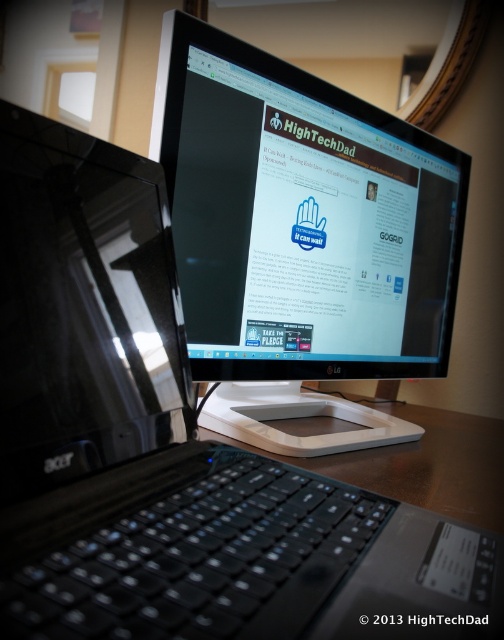
Does black glossy monitor at upper center appear on the right side of brown wooden table at center?

In fact, black glossy monitor at upper center is to the left of brown wooden table at center.

Is black glossy monitor at upper center wider than brown wooden table at center?

No.

Identify the location of black glossy monitor at upper center. The height and width of the screenshot is (640, 504). (300, 237).

Does black glossy monitor at upper center have a greater width compared to glossy black monitor at center?

Correct, the width of black glossy monitor at upper center exceeds that of glossy black monitor at center.

Find the location of a particular element. This screenshot has height=640, width=504. black glossy monitor at upper center is located at coordinates (300, 237).

Where is `black glossy monitor at upper center`? This screenshot has height=640, width=504. black glossy monitor at upper center is located at coordinates (300, 237).

Can you confirm if glossy black monitor at center is taller than brown wooden table at center?

Yes, glossy black monitor at center is taller than brown wooden table at center.

Who is more forward, (83,412) or (421,465)?

Positioned in front is point (83,412).

Is point (109, 336) in front of point (423, 458)?

Yes, point (109, 336) is closer to viewer.

Identify the location of glossy black monitor at center. The width and height of the screenshot is (504, 640). (83, 308).